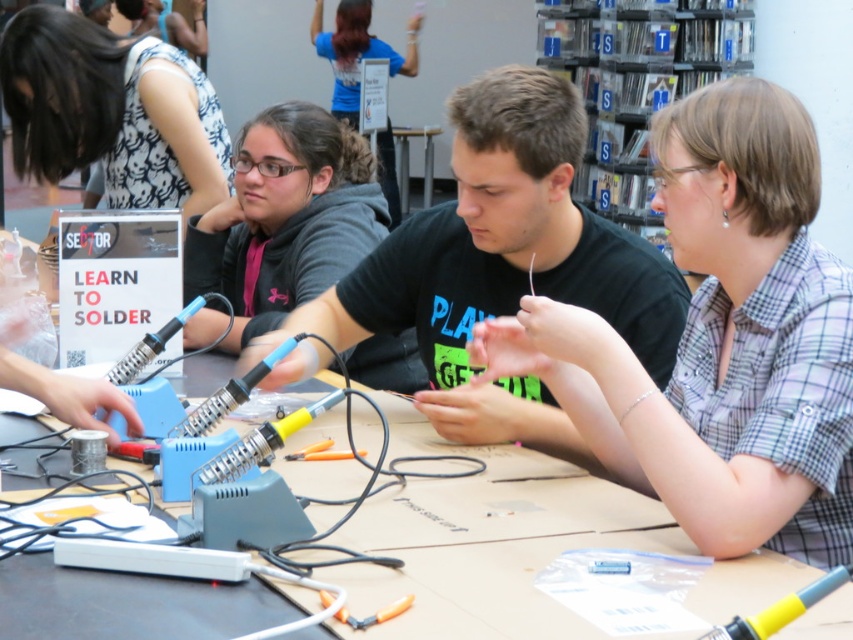
You are a participant in the soldering workshop and need to reach the point marked at coordinates point (746,492). Your arm can extend 1.2 meters. Can you reach it?

The distance between you and point (746,492) is 1.38 meters, which is beyond your arm reach of 1.2 meters. You cannot reach it.